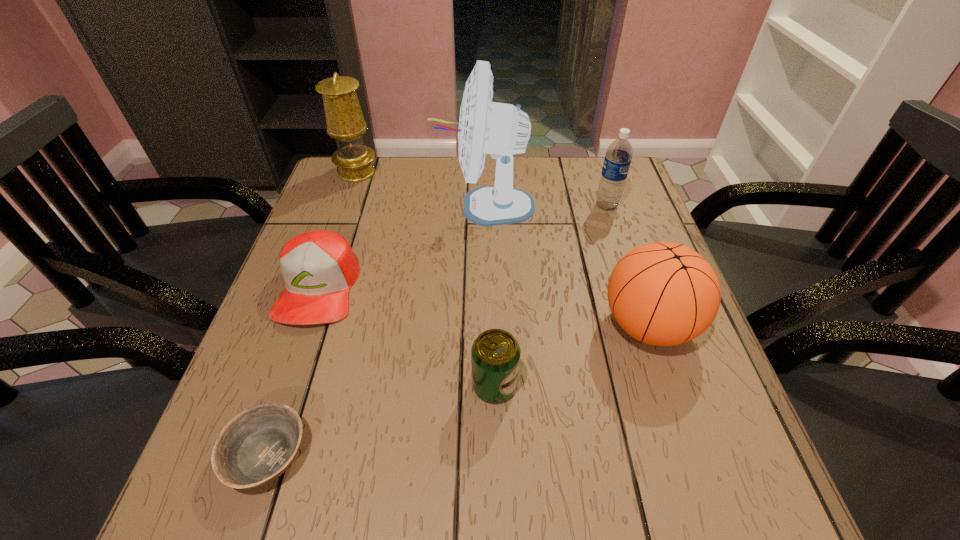
Locate an element on the screen. fan is located at coordinates (501, 130).

Where is `the second tallest object`? This screenshot has width=960, height=540. the second tallest object is located at coordinates [x=344, y=118].

Locate an element on the screen. The image size is (960, 540). water bottle is located at coordinates (618, 156).

Find the location of `basketball`. basketball is located at coordinates (664, 294).

The height and width of the screenshot is (540, 960). Find the location of `beer can`. beer can is located at coordinates click(495, 354).

This screenshot has height=540, width=960. What are the coordinates of `the second shortest object` in the screenshot? It's located at (319, 267).

This screenshot has height=540, width=960. I want to click on the shortest object, so (257, 446).

What are the coordinates of `bowl` in the screenshot? It's located at (257, 446).

Where is `vacant space situated 0.240m on the grille of the fan`? This screenshot has height=540, width=960. vacant space situated 0.240m on the grille of the fan is located at coordinates (349, 206).

Where is `free spot located on the grille of the fan`? This screenshot has height=540, width=960. free spot located on the grille of the fan is located at coordinates (357, 206).